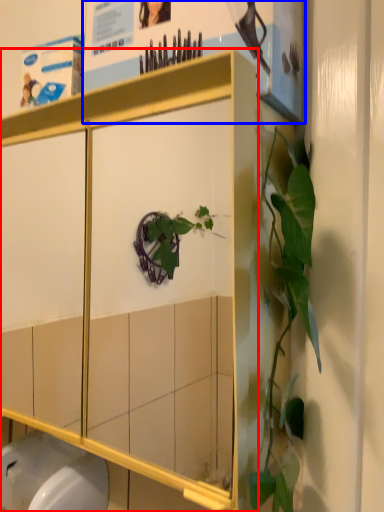
Question: Which object is closer to the camera taking this photo, cabinetry (highlighted by a red box) or poster page (highlighted by a blue box)?

Choices:
 (A) cabinetry
 (B) poster page

Answer: (A)